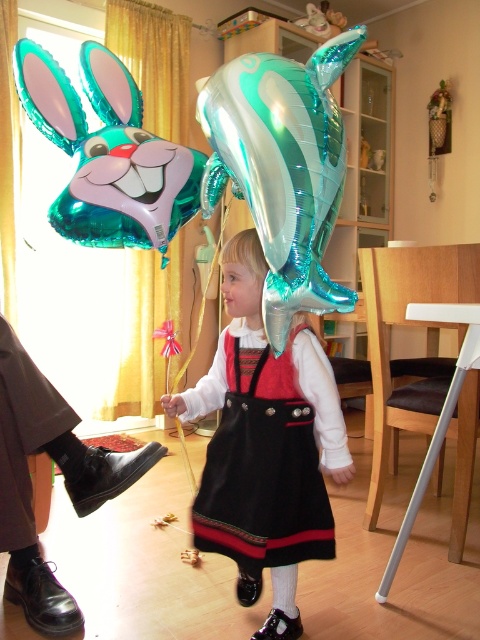
You are a photographer setting up a shoot in this room. You need to ensure that the teal metallic balloon at upper left and the black fabric dress at center are both visible in the frame. Based on their positions, which object is higher up in the image?

The teal metallic balloon at upper left is much taller than the black fabric dress at center, so it is higher up in the image.

You are a child who wants to choose the bigger balloon between the shiny metallic balloon at center and the teal metallic dolphin at upper center. Which one should you pick?

The shiny metallic balloon at center is bigger than the teal metallic dolphin at upper center, so you should pick the shiny metallic balloon at center.